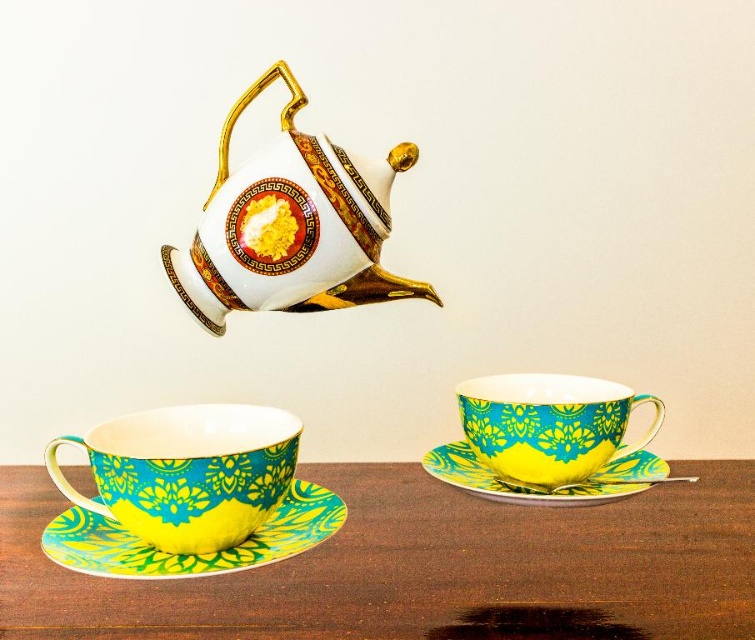
Question: Estimate the real-world distances between objects in this image. Which object is closer to the white porcelain teapot at upper center?

Choices:
 (A) yellow glossy saucer at lower right
 (B) turquoise glossy teacup at lower right

Answer: (B)

Question: Which of the following is the farthest from the observer?

Choices:
 (A) (424, 600)
 (B) (538, 480)

Answer: (B)

Question: Can you confirm if matte ceramic table at lower center is positioned below turquoise glossy teacup at lower left?

Choices:
 (A) no
 (B) yes

Answer: (B)

Question: Is matte ceramic table at lower center to the left of white porcelain teapot at upper center from the viewer's perspective?

Choices:
 (A) no
 (B) yes

Answer: (A)

Question: Which of the following is the closest to the observer?

Choices:
 (A) turquoise glossy teacup at lower right
 (B) yellow glossy saucer at lower right
 (C) matte ceramic table at lower center
 (D) turquoise glossy teacup at lower left

Answer: (D)

Question: Does turquoise glossy teacup at lower left appear on the left side of turquoise glossy teacup at lower right?

Choices:
 (A) no
 (B) yes

Answer: (B)